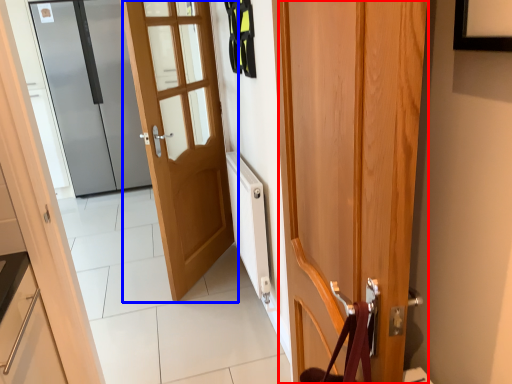
Question: Which object appears farthest to the camera in this image, door (highlighted by a red box) or door (highlighted by a blue box)?

Choices:
 (A) door
 (B) door

Answer: (B)